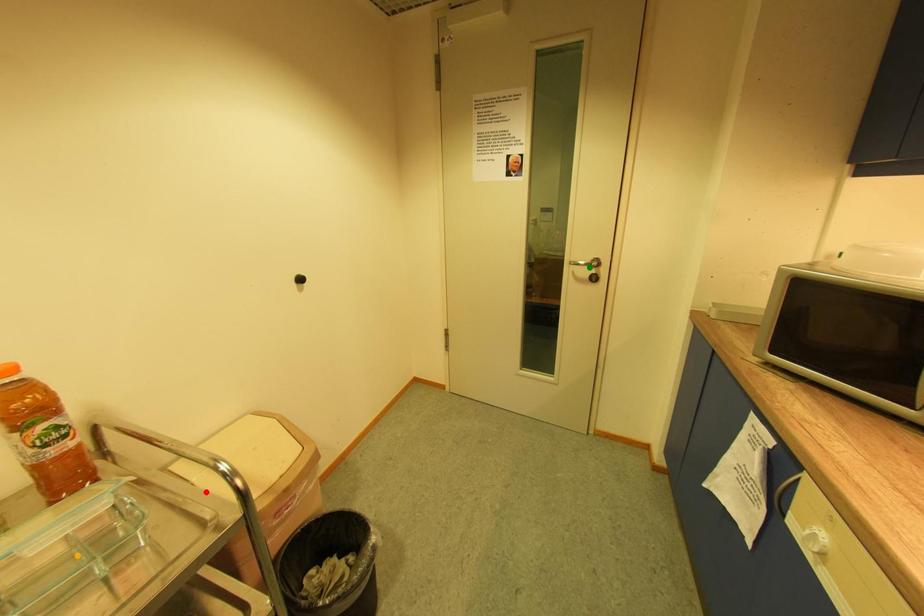
Order these from nearest to farthest:
green point | red point | orange point

green point, red point, orange point